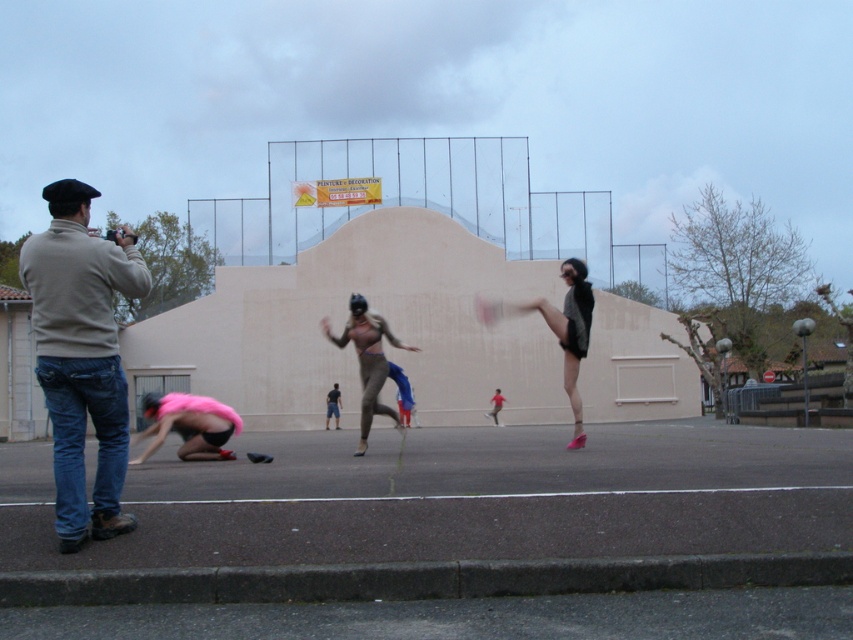
Question: Among these points, which one is farthest from the camera?

Choices:
 (A) (21, 253)
 (B) (181, 432)
 (C) (579, 424)

Answer: (B)

Question: Does denim jeans at left appear on the left side of matte beige bodysuit at center?

Choices:
 (A) yes
 (B) no

Answer: (A)

Question: Does matte black shorts at center come behind pink fabric at lower left?

Choices:
 (A) yes
 (B) no

Answer: (B)

Question: Is denim jeans at left further to camera compared to matte beige bodysuit at center?

Choices:
 (A) no
 (B) yes

Answer: (A)

Question: Which of these objects is positioned closest to the matte black shorts at center?

Choices:
 (A) matte beige bodysuit at center
 (B) denim jeans at left
 (C) pink fabric at lower left

Answer: (A)

Question: Which object appears farthest from the camera in this image?

Choices:
 (A) matte black shorts at center
 (B) matte beige bodysuit at center

Answer: (B)